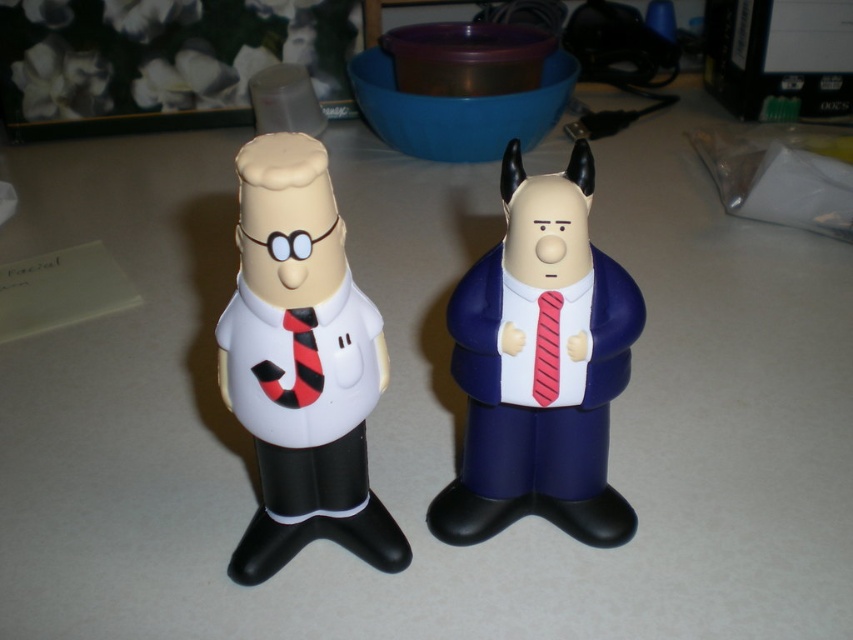
What do you see at coordinates (293, 365) in the screenshot? I see `matte white figure at center` at bounding box center [293, 365].

Is point (392, 552) closer to viewer compared to point (260, 362)?

No, (392, 552) is behind (260, 362).

Identify the location of matte white figure at center. (293, 365).

Can you confirm if matte white figure at center is positioned to the right of red striped tie at right?

Incorrect, matte white figure at center is not on the right side of red striped tie at right.

Identify the location of matte white figure at center. The image size is (853, 640). (293, 365).

Can you confirm if black/red striped tie at center is positioned below red striped tie at right?

Yes.

Is point (270, 376) positioned after point (541, 308)?

That is False.

Which is in front, point (306, 342) or point (553, 340)?

Point (306, 342)

In order to click on black/red striped tie at center in this screenshot , I will do `click(300, 360)`.